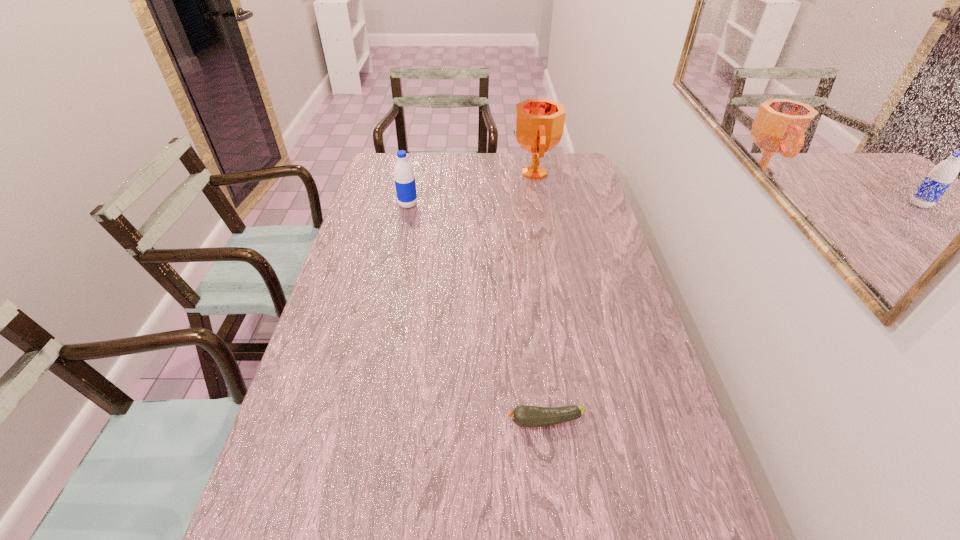
Where is `award`? Image resolution: width=960 pixels, height=540 pixels. award is located at coordinates [x=538, y=127].

What are the coordinates of `the tallest object` in the screenshot? It's located at (538, 127).

Where is `the second farthest object`? This screenshot has height=540, width=960. the second farthest object is located at coordinates (405, 185).

The image size is (960, 540). I want to click on water bottle, so click(405, 185).

Identify the location of the nearest object. (525, 416).

I want to click on the shortest object, so click(x=525, y=416).

You are a GUI agent. You are given a task and a screenshot of the screen. Output one action in this format:
    pyautogui.click(x=<x>, y=<y>)
    Task: Click on the vacant area located 0.260m on the side of the tallest object with the star emblem
    
    Given the screenshot: What is the action you would take?
    pyautogui.click(x=448, y=173)

Image resolution: width=960 pixels, height=540 pixels. Identify the location of vacant region located 0.240m on the side of the tallest object with the star emblem. (453, 173).

Image resolution: width=960 pixels, height=540 pixels. I want to click on vacant area located 0.320m on the side of the tallest object with the star emblem, so [434, 173].

Where is `vacant space located on the front of the second tallest object`? vacant space located on the front of the second tallest object is located at coordinates (399, 246).